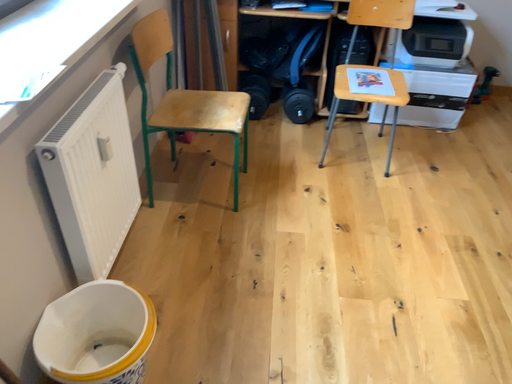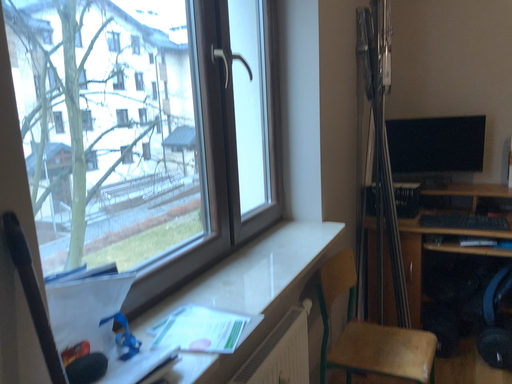
Question: Which way did the camera rotate in the video?

Choices:
 (A) rotated downward
 (B) rotated upward

Answer: (B)